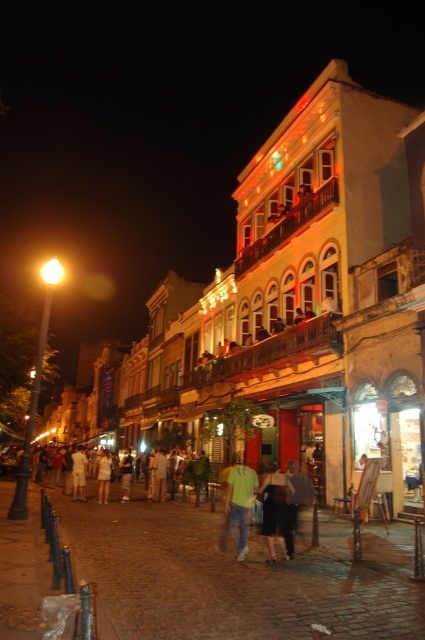
Can you confirm if light green t-shirt at center is bigger than dark fabric dress at center?

Indeed, light green t-shirt at center has a larger size compared to dark fabric dress at center.

Which of these two, light green t-shirt at center or dark fabric dress at center, stands shorter?

dark fabric dress at center

The height and width of the screenshot is (640, 425). In order to click on light green t-shirt at center in this screenshot , I will do `click(240, 504)`.

You are a GUI agent. You are given a task and a screenshot of the screen. Output one action in this format:
    pyautogui.click(x=<x>, y=<y>)
    Task: Click on the light green t-shirt at center
    The height and width of the screenshot is (640, 425).
    Given the screenshot: What is the action you would take?
    pyautogui.click(x=240, y=504)